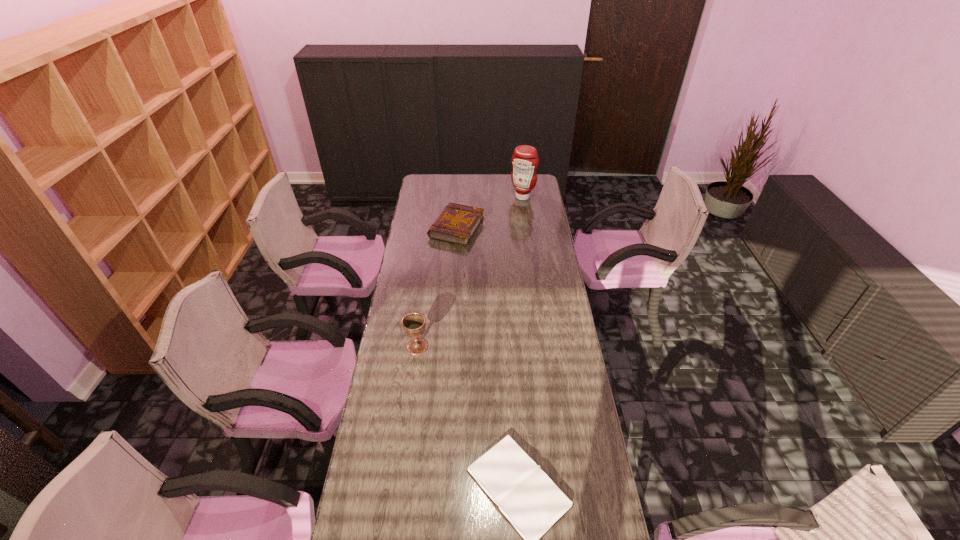
Identify the location of chalice situated at the left edge. (414, 323).

Image resolution: width=960 pixels, height=540 pixels. I want to click on hardback book that is positioned at the left edge, so coord(457,224).

At what (x,y) coordinates should I click in order to perform the action: click on object located at the right edge. Please return your answer as a coordinate pair (x, y). The width and height of the screenshot is (960, 540). Looking at the image, I should click on [x=525, y=160].

Locate an element on the screen. The height and width of the screenshot is (540, 960). object present at the far right corner is located at coordinates (525, 160).

Find the location of a particular element. This screenshot has height=540, width=960. free space at the far edge of the desktop is located at coordinates (490, 183).

This screenshot has width=960, height=540. In the image, there is a desktop. Find the location of `vacant region at the left edge`. vacant region at the left edge is located at coordinates (441, 198).

In the image, there is a desktop. At what (x,y) coordinates should I click in order to perform the action: click on vacant space at the right edge. Please return your answer as a coordinate pair (x, y). Looking at the image, I should click on (548, 298).

The image size is (960, 540). In order to click on free space between the third tallest object and the tallest object in this screenshot , I will do `click(490, 212)`.

Where is `free point between the tallest object and the third nearest object`? The height and width of the screenshot is (540, 960). free point between the tallest object and the third nearest object is located at coordinates (490, 212).

This screenshot has height=540, width=960. Find the location of `empty space that is in between the farther hardback book and the chalice`. empty space that is in between the farther hardback book and the chalice is located at coordinates (437, 287).